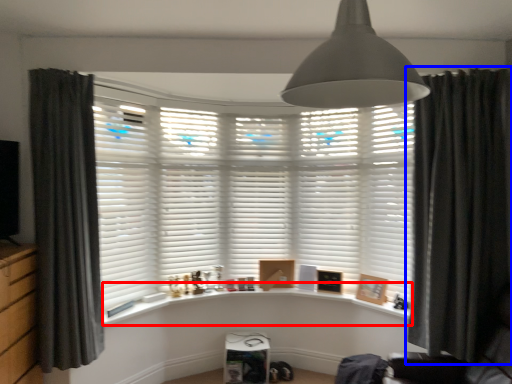
Question: Which object appears farthest to the camera in this image, window sill (highlighted by a red box) or curtain (highlighted by a blue box)?

Choices:
 (A) window sill
 (B) curtain

Answer: (A)